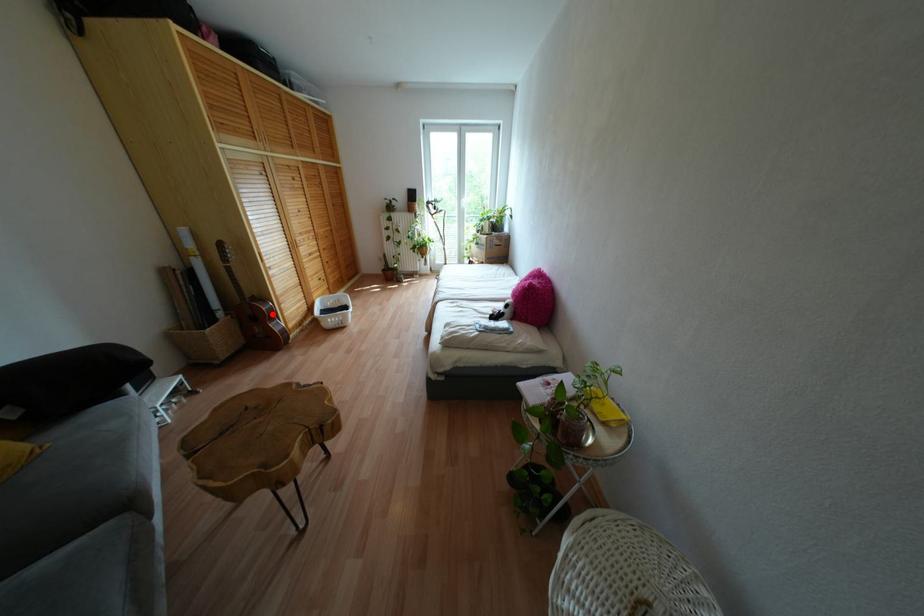
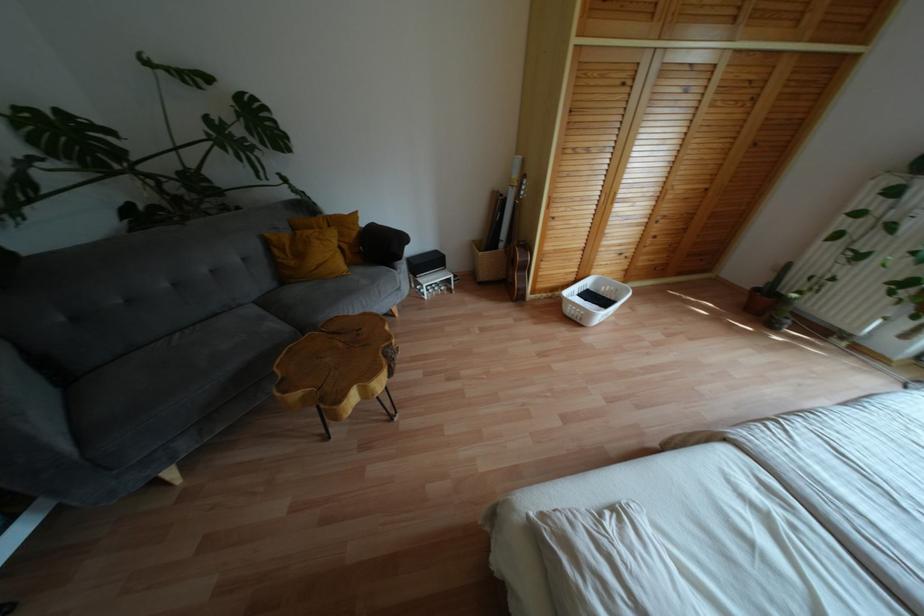
The point at the highlighted location is marked in the first image. Where is the corresponding point in the second image?

(525, 267)